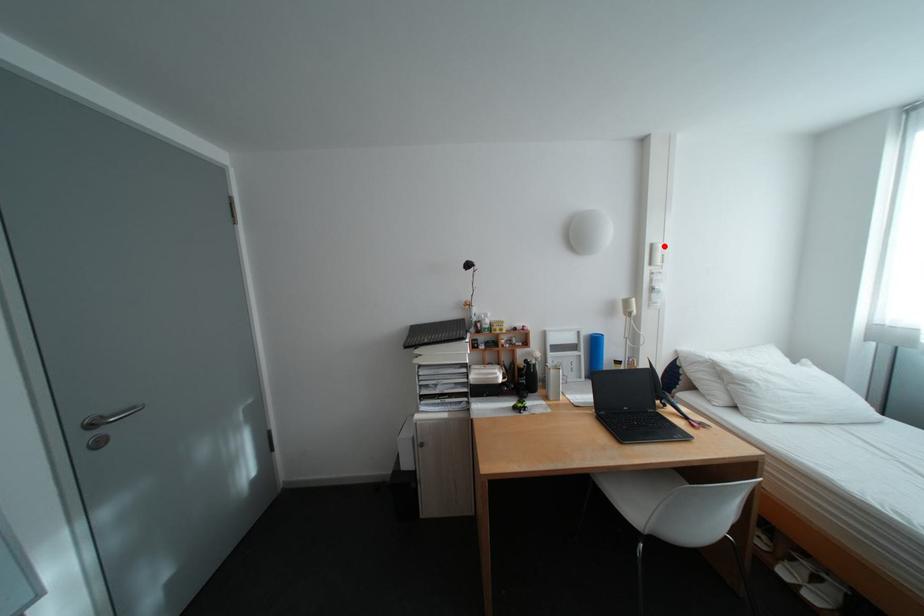
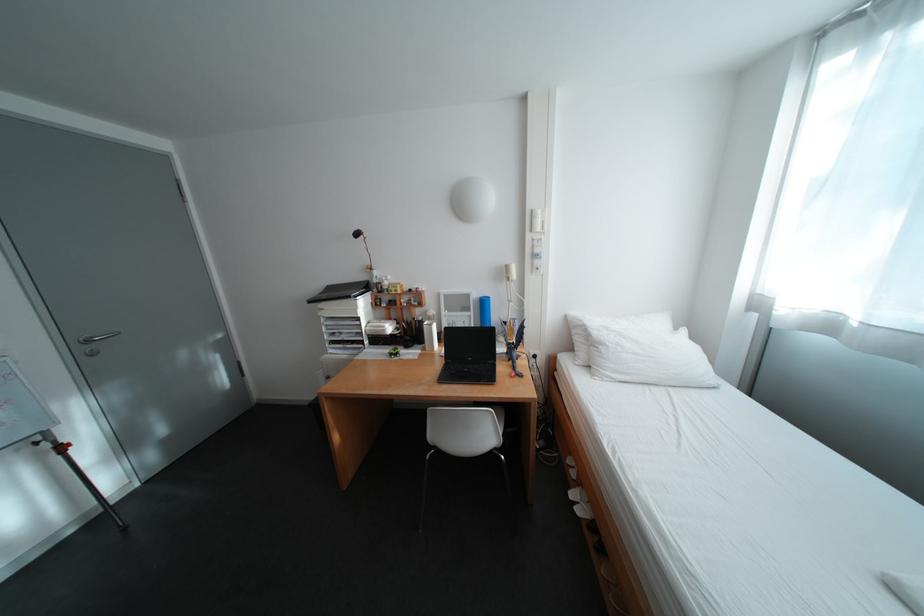
Question: I am providing you with two images of the same scene from different viewpoints. In image1, a red point is highlighted. Considering the same 3D point in image2, which of the following is correct?

Choices:
 (A) It is closer
 (B) It is farther

Answer: (A)